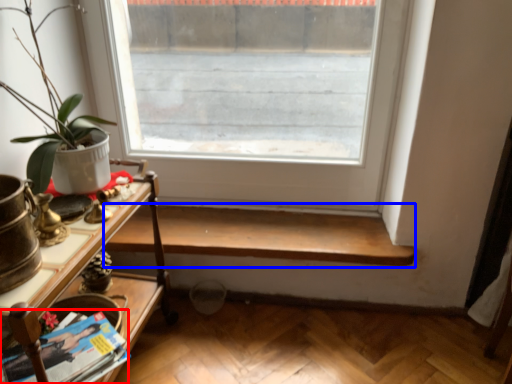
Question: Which object is further to the camera taking this photo, magazine (highlighted by a red box) or shelf (highlighted by a blue box)?

Choices:
 (A) magazine
 (B) shelf

Answer: (B)